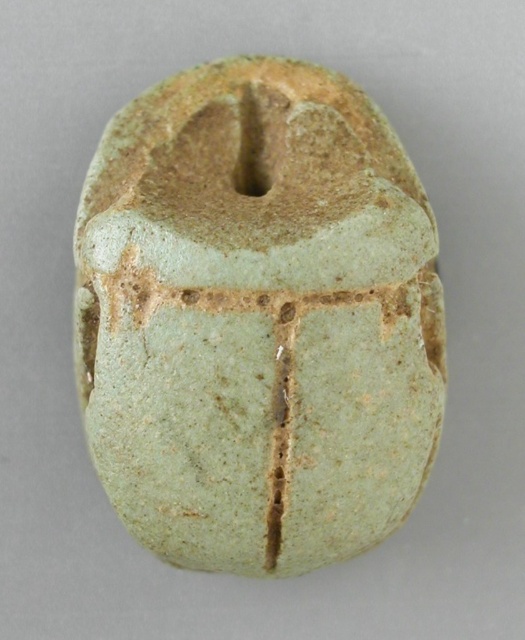
Can you confirm if green stone scarab at center is thinner than green cracked scarab at center?

No.

Measure the distance between green stone scarab at center and camera.

green stone scarab at center and camera are 1.14 meters apart from each other.

Identify the location of green stone scarab at center. Image resolution: width=525 pixels, height=640 pixels. (257, 317).